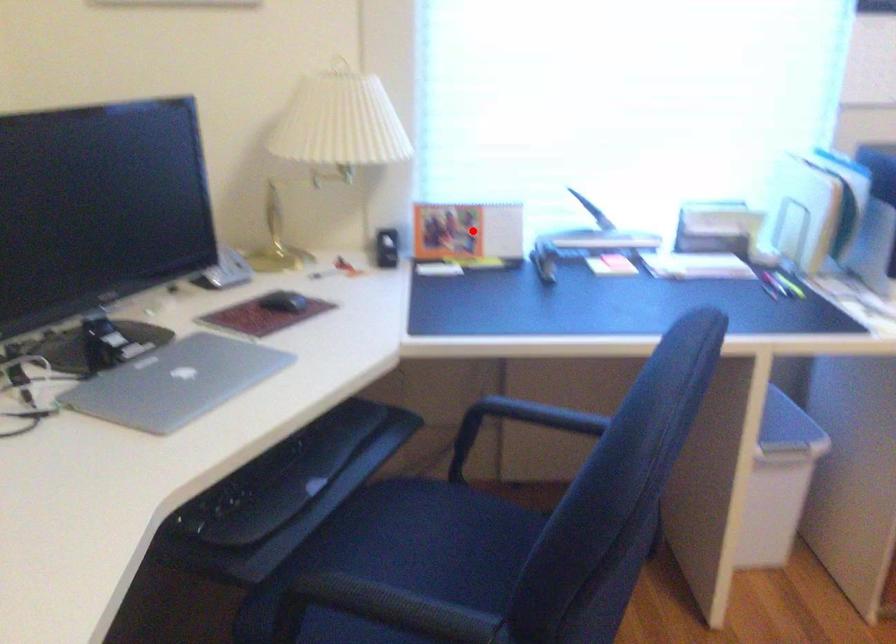
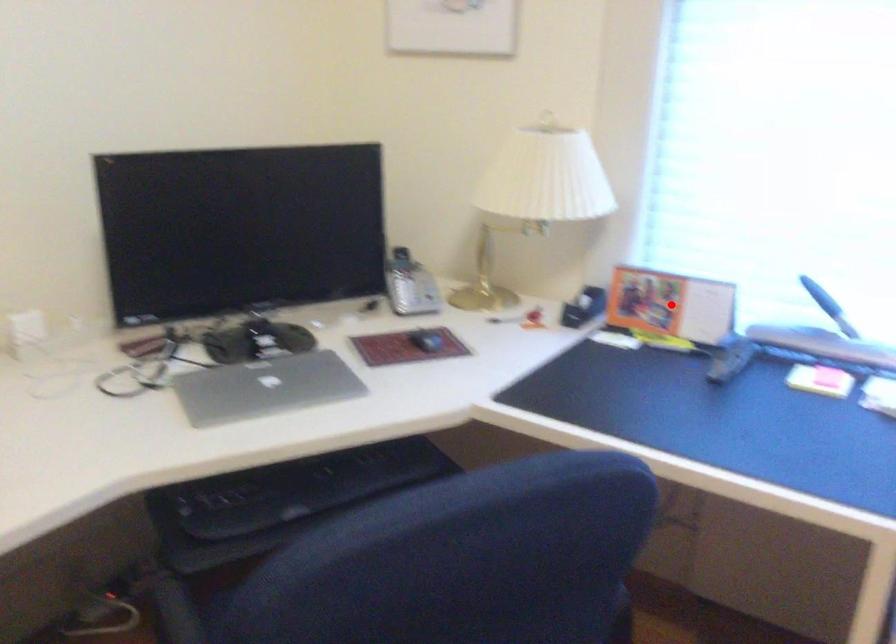
I am providing you with two images of the same scene from different viewpoints. A red point is marked on the first image and another point is marked on the second image. Does the point marked in image1 correspond to the same location as the one in image2?

Yes